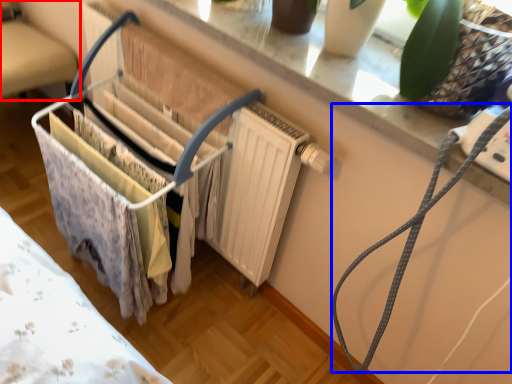
Question: Which object is further to the camera taking this photo, furniture (highlighted by a red box) or string (highlighted by a blue box)?

Choices:
 (A) furniture
 (B) string

Answer: (A)